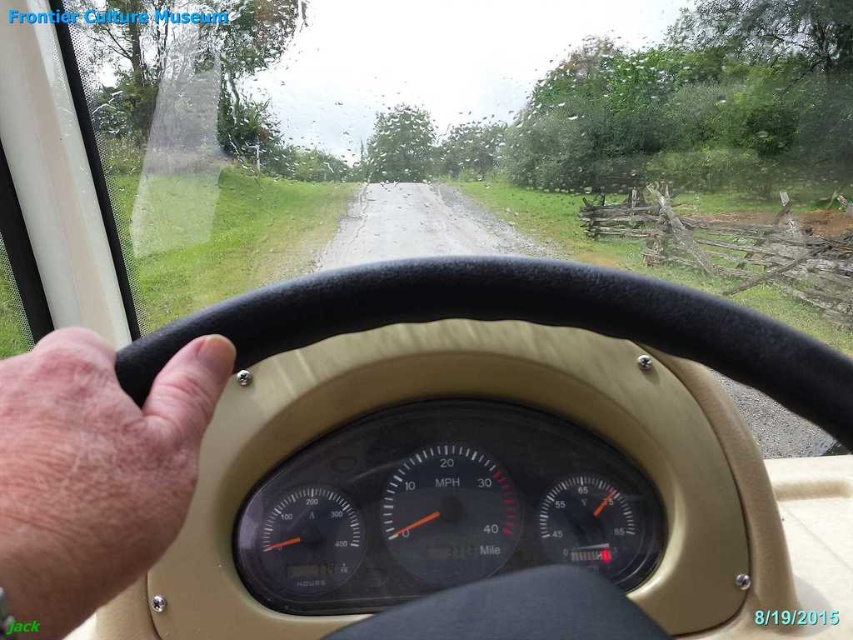
Question: Which point is closer to the camera?

Choices:
 (A) black plastic speedometer at center
 (B) flesh-toned skin at center

Answer: (B)

Question: Is black plastic speedometer at center wider than flesh-toned skin at center?

Choices:
 (A) no
 (B) yes

Answer: (B)

Question: Is black plastic speedometer at center behind flesh-toned skin at center?

Choices:
 (A) no
 (B) yes

Answer: (B)

Question: Can you confirm if black plastic speedometer at center is positioned below flesh-toned skin at center?

Choices:
 (A) yes
 (B) no

Answer: (A)

Question: Which of the following is the farthest from the observer?

Choices:
 (A) (184, 412)
 (B) (254, 557)

Answer: (B)